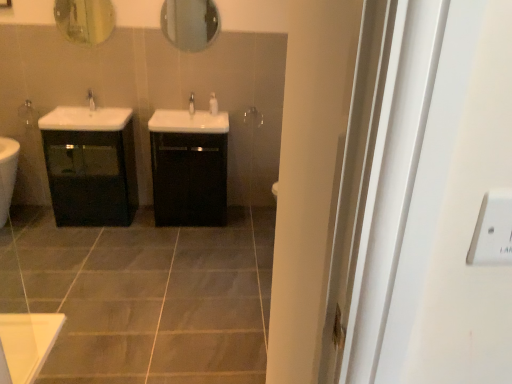
Where is `vacant area that is situated to the right of matte black cabinet at left, the second bathroom cabinet in the right-to-left sequence`? The height and width of the screenshot is (384, 512). vacant area that is situated to the right of matte black cabinet at left, the second bathroom cabinet in the right-to-left sequence is located at coordinates (145, 229).